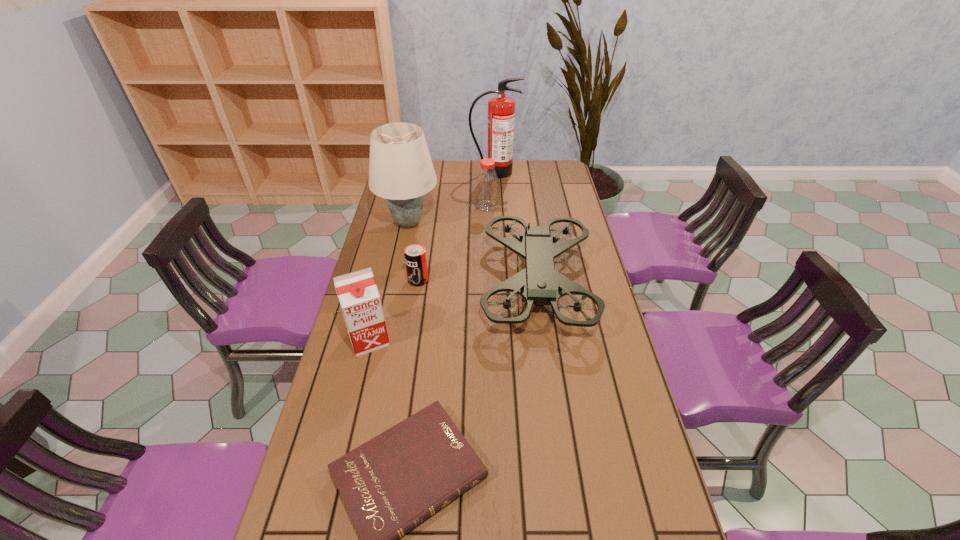
You are a GUI agent. You are given a task and a screenshot of the screen. Output one action in this format:
    pyautogui.click(x=<x>, y=<y>)
    Task: Click on the free space that satisfies the following two spatial constraints: 1. on the front side of the lampshade; 2. on the left side of the drone
    
    Given the screenshot: What is the action you would take?
    point(396,283)

The width and height of the screenshot is (960, 540). What are the coordinates of `blank area in the image that satisfies the following two spatial constraints: 1. on the back side of the soya milk; 2. on the right side of the lampshade` in the screenshot? It's located at (396, 223).